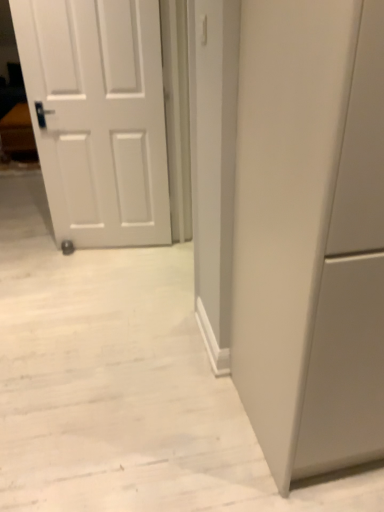
Question: Should I look upward or downward to see matte gray cabinet at right?

Choices:
 (A) up
 (B) down

Answer: (B)